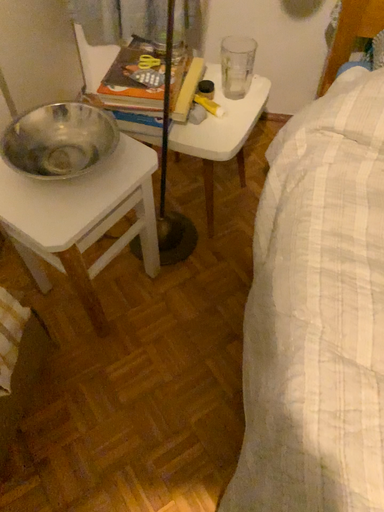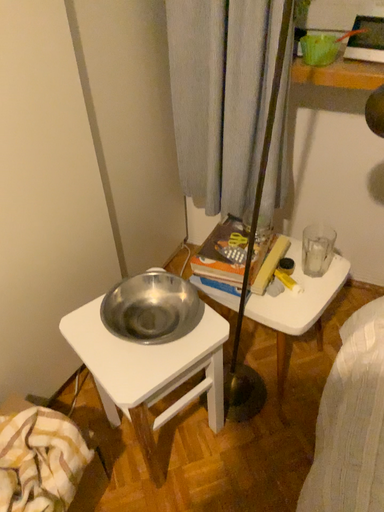
Question: How did the camera likely rotate when shooting the video?

Choices:
 (A) rotated downward
 (B) rotated upward

Answer: (B)